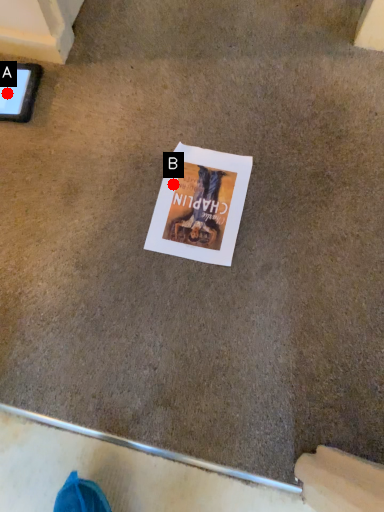
Question: Two points are circled on the image, labeled by A and B beside each circle. Which of the following is the farthest from the observer?

Choices:
 (A) A is further
 (B) B is further

Answer: (A)